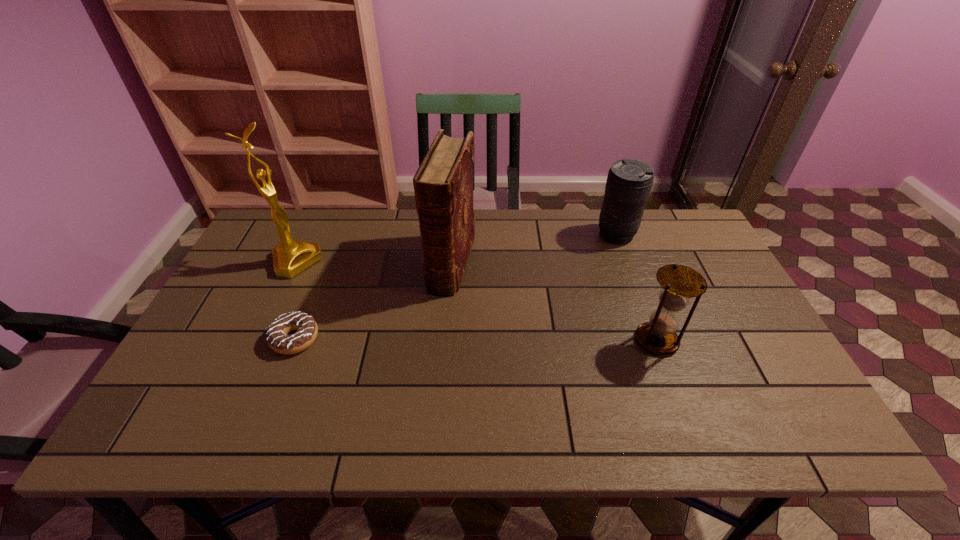
Locate an element on the screen. object that is positioned at the left edge is located at coordinates (290, 257).

The width and height of the screenshot is (960, 540). Identify the location of object present at the far left corner. (290, 257).

In the image, there is a desktop. Identify the location of free region at the far edge. (513, 244).

At what (x,y) coordinates should I click in order to perform the action: click on vacant space at the near edge. Please return your answer as a coordinate pair (x, y). This screenshot has width=960, height=540. Looking at the image, I should click on (711, 376).

What are the coordinates of `vacant region at the left edge of the desktop` in the screenshot? It's located at (258, 257).

Locate an element on the screen. The width and height of the screenshot is (960, 540). vacant space at the right edge of the desktop is located at coordinates (748, 339).

Image resolution: width=960 pixels, height=540 pixels. In order to click on vacant area at the far left corner of the desktop in this screenshot , I will do `click(276, 237)`.

I want to click on vacant point located between the second tallest object and the award, so click(373, 263).

The image size is (960, 540). What are the coordinates of `vacant space in between the award and the hourglass` in the screenshot? It's located at (476, 301).

Image resolution: width=960 pixels, height=540 pixels. Identify the location of vacant space in between the award and the fourth shortest object. (373, 263).